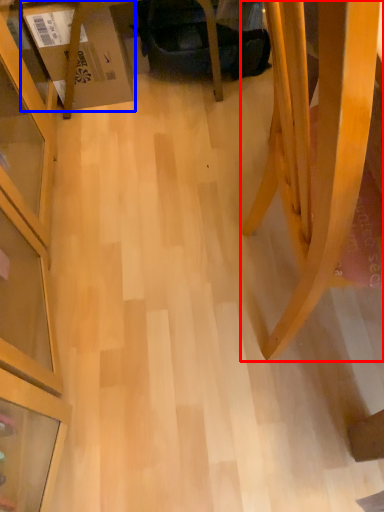
Question: Which point is closer to the camera, furniture (highlighted by a red box) or cardboard box (highlighted by a blue box)?

Choices:
 (A) furniture
 (B) cardboard box

Answer: (A)